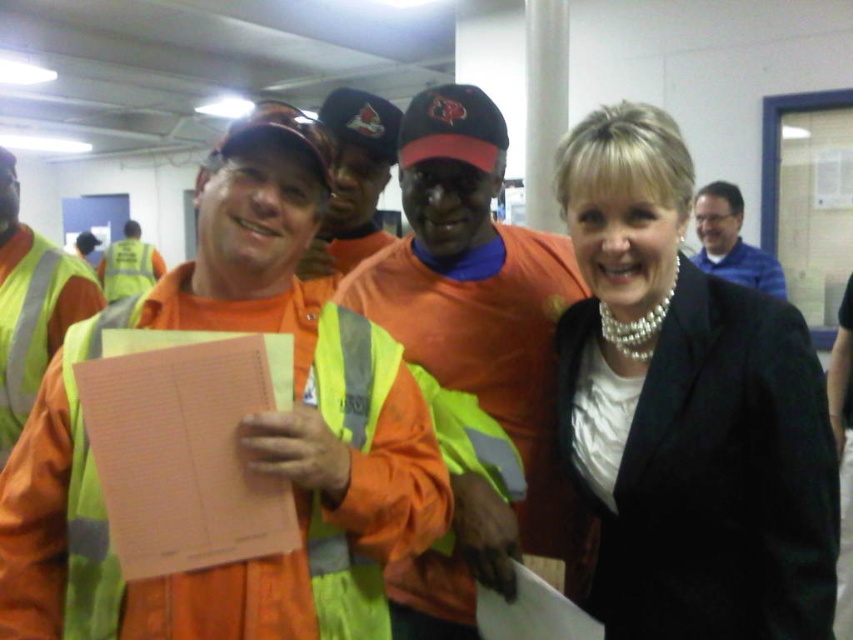
What is located at the coordinates point (686,410) in the image?

The pearl necklace at upper right is located at point (686,410).

You are standing in the workshop and want to move from point A to point B. Point A is at coordinate point (376,598) and point B is at coordinate point (340,124). Which point is closer to you when you start?

Point A at coordinate point (376,598) is closer to you than point B at coordinate point (340,124).